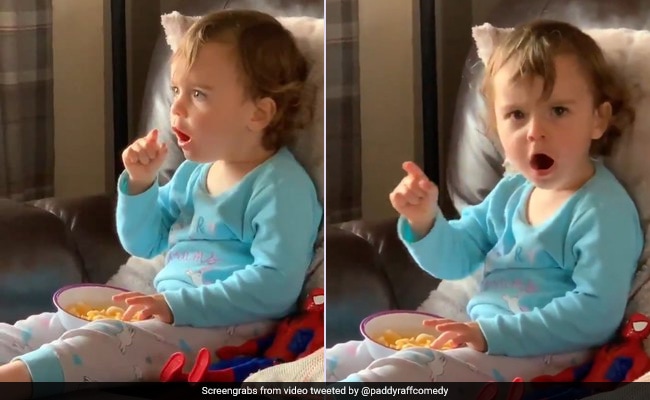
Locate an element on the screen. window shade is located at coordinates (21, 44), (333, 103).